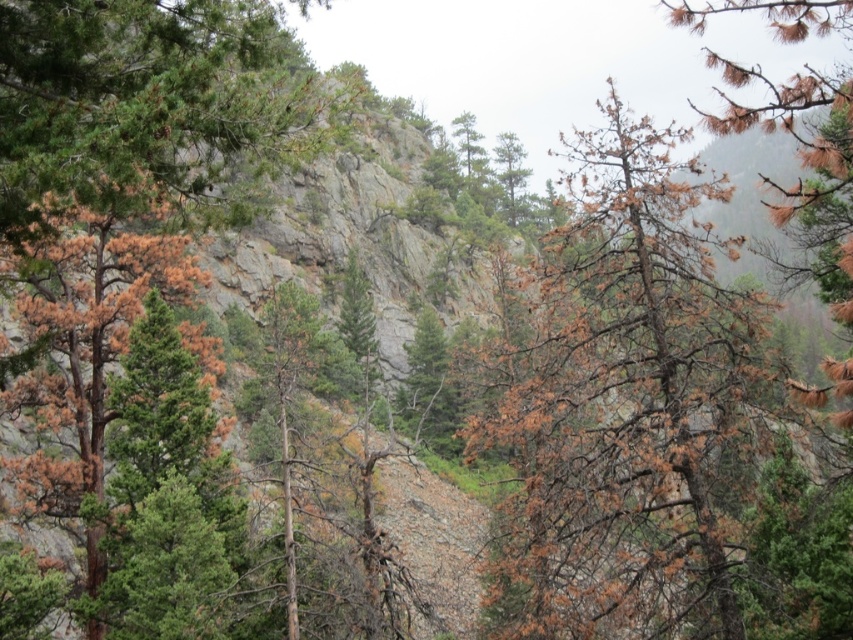
Can you confirm if brown/dried needles at right is smaller than green matte tree at upper left?

Incorrect, brown/dried needles at right is not smaller in size than green matte tree at upper left.

Can you confirm if brown/dried needles at right is thinner than green matte tree at upper left?

→ No, brown/dried needles at right is not thinner than green matte tree at upper left.

Does point (601, 470) lie behind point (149, 77)?

Yes, it is behind point (149, 77).

At what (x,y) coordinates should I click in order to perform the action: click on brown/dried needles at right. Please return your answer as a coordinate pair (x, y). The image size is (853, 640). Looking at the image, I should click on (628, 406).

Can you confirm if brown/dried needles at right is positioned above brown textured tree at left?

Indeed, brown/dried needles at right is positioned over brown textured tree at left.

Which is in front, point (720, 436) or point (71, 209)?

Point (71, 209) is more forward.

What do you see at coordinates (628, 406) in the screenshot? The image size is (853, 640). I see `brown/dried needles at right` at bounding box center [628, 406].

Find the location of a particular element. This screenshot has height=640, width=853. brown/dried needles at right is located at coordinates (628, 406).

Based on the photo, who is higher up, green matte tree at upper left or brown textured tree at left?

green matte tree at upper left is higher up.

The width and height of the screenshot is (853, 640). Describe the element at coordinates (144, 106) in the screenshot. I see `green matte tree at upper left` at that location.

Where is `green matte tree at upper left`? green matte tree at upper left is located at coordinates (144, 106).